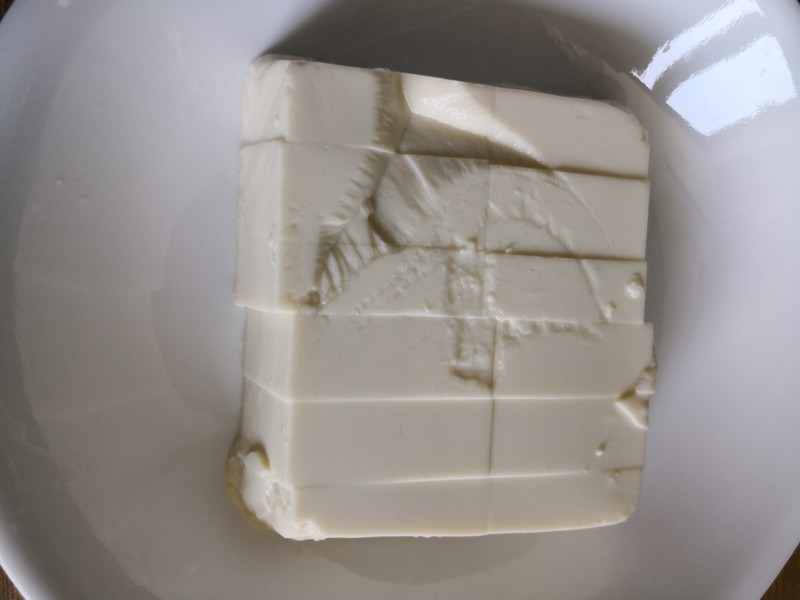
The height and width of the screenshot is (600, 800). Find the location of `edge of plate`. edge of plate is located at coordinates (10, 580), (776, 574).